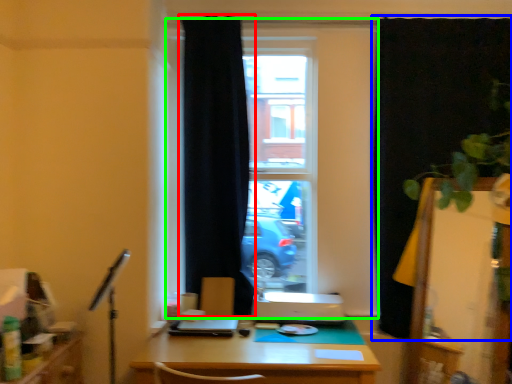
Question: Considering the real-world distances, which object is farthest from curtain (highlighted by a red box)? curtain (highlighted by a blue box) or window (highlighted by a green box)?

Choices:
 (A) curtain
 (B) window

Answer: (A)